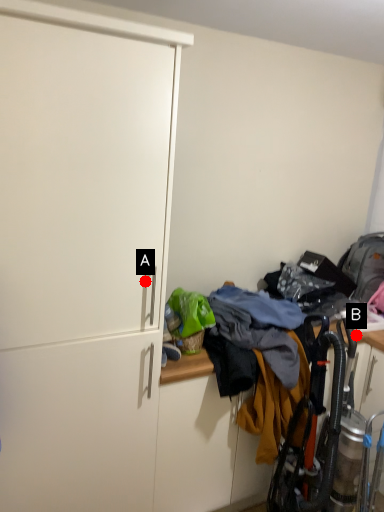
Question: Two points are circled on the image, labeled by A and B beside each circle. Which point appears farthest from the camera in this image?

Choices:
 (A) A is further
 (B) B is further

Answer: (B)